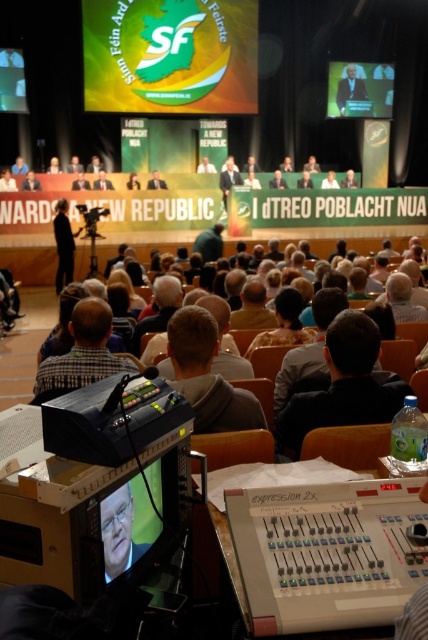
You are a photographer at the event and need to ensure all attendees in the front row are visible in the photo. Considering the dark gray suit at center and the blonde hair at center, which one is more likely to block the view of others behind them?

The dark gray suit at center is much taller than the blonde hair at center, so it is more likely to block the view of others behind them.

You are standing at the back of the auditorium and want to move towards the stage. There are two points marked in the scene, point (x=202, y=61) and point (x=341, y=99). Which point should you head towards to get closer to the stage?

Point (x=202, y=61) is closer to the viewer than point (x=341, y=99). Since you are at the back of the auditorium, moving toward point (x=202, y=61) would bring you closer to the stage as it is nearer to your current position.

In the scene shown: You are a photographer at the event and need to capture a photo that includes both the green matte logo at upper center and the blonde hair at center. Based on their sizes in the image, which object should you focus on first to ensure both are in frame?

The green matte logo at upper center is much taller than the blonde hair at center, so you should focus on the green matte logo at upper center first to ensure both fit within the frame.